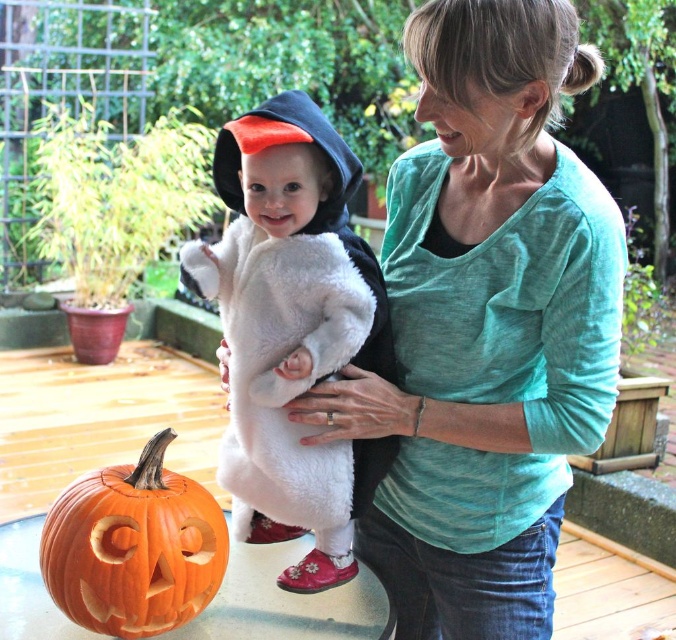
You are a photographer standing at a distance of 1 meter from the scene. You want to capture a closeup shot of the fluffy white costume at center. Is your current distance sufficient to focus on the costume without it appearing too small in the frame?

The fluffy white costume at center is 1.27 meters away from the viewer. Since you are standing at 1 meter, you are closer than the costume, so you need to move back to 1.27 meters to focus properly. Alternatively, use a zoom lens to capture the closeup without moving.

You are a costume designer trying to create a matching outfit for the woman and the child. The woman is wearing a teal soft shirt at center, and the child is in a fluffy white costume at center. Which clothing item is larger in size?

The teal soft shirt at center is bigger than the fluffy white costume at center.